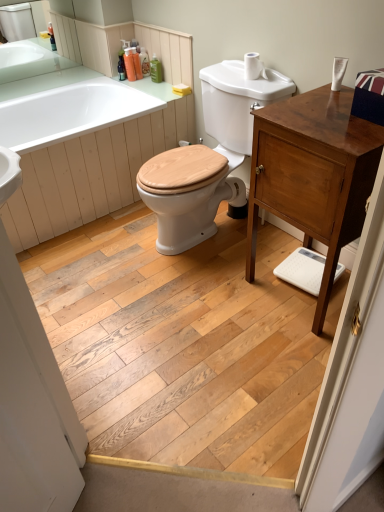
This screenshot has width=384, height=512. I want to click on free location in front of translucent plastic soap dispenser at upper center, which is counted as the 3th toiletry, starting from the right, so click(x=148, y=81).